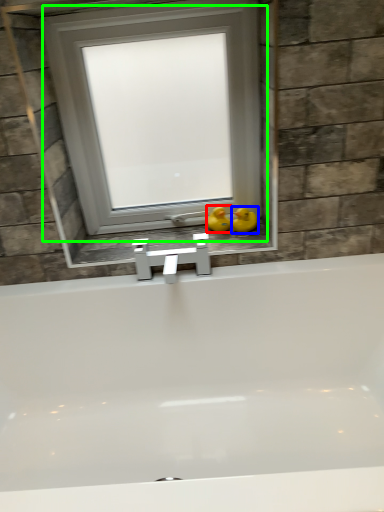
Question: Which is farther away from duck (highlighted by a red box)? duck (highlighted by a blue box) or window (highlighted by a green box)?

Choices:
 (A) duck
 (B) window

Answer: (B)